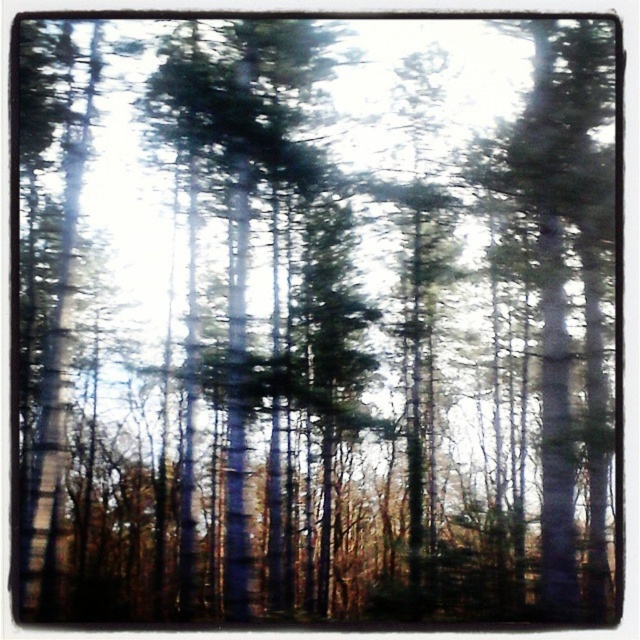
Between green matte tree at center and green matte tree at right, which one appears on the right side from the viewer's perspective?

green matte tree at right

The image size is (640, 640). What do you see at coordinates (259, 298) in the screenshot?
I see `green matte tree at center` at bounding box center [259, 298].

Where is `green matte tree at center`? green matte tree at center is located at coordinates tap(259, 298).